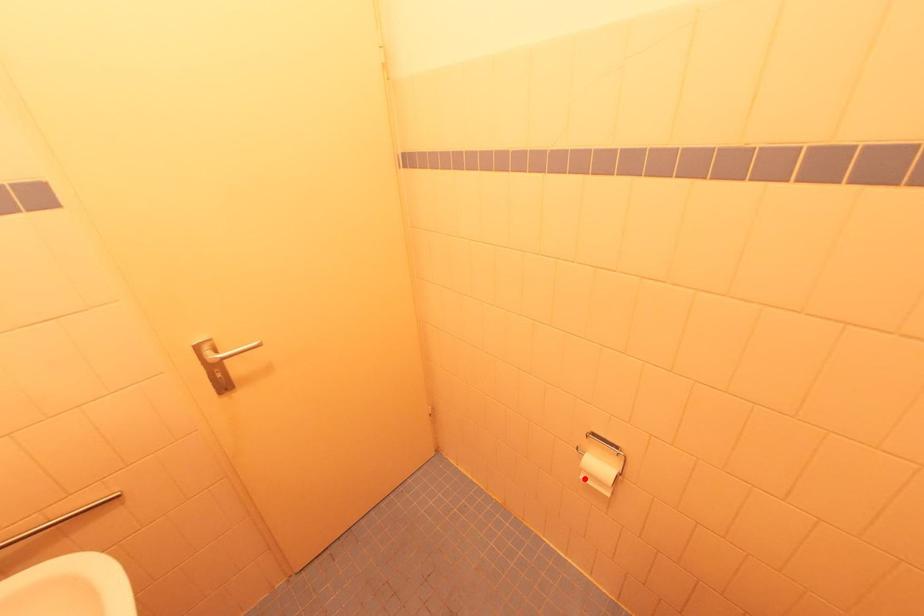
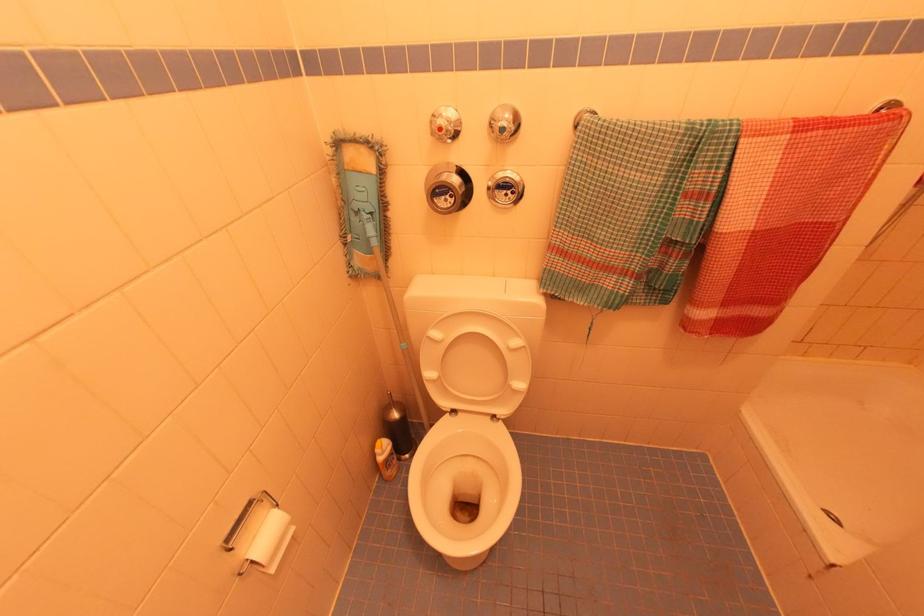
Where in the second image is the point corresponding to the highlighted location from the first image?

(274, 570)